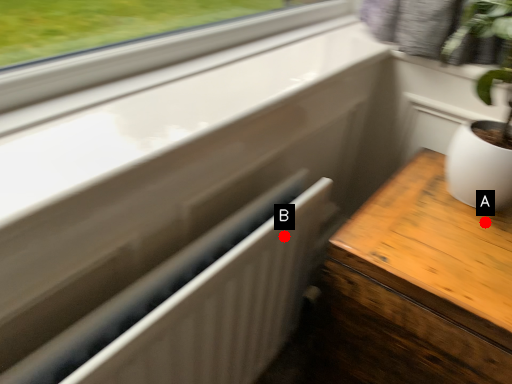
Question: Two points are circled on the image, labeled by A and B beside each circle. Which point is farther to the camera?

Choices:
 (A) A is further
 (B) B is further

Answer: (A)